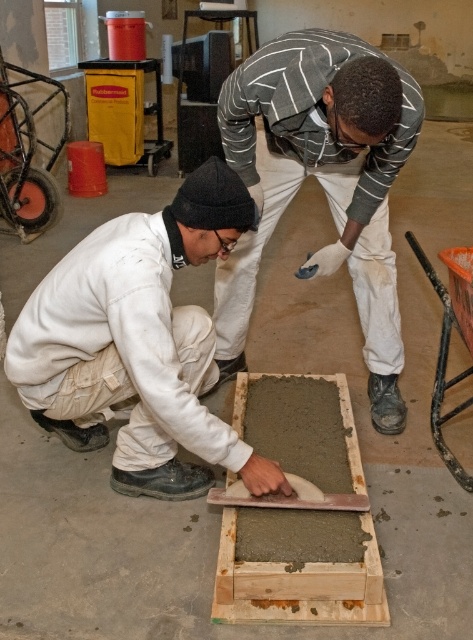
You are a safety inspector in this workshop. You notice two workers wearing the white matte uniform at lower left and the striped sweater at center. According to safety protocols, workers must maintain a distance of at least 1 meter from each other when handling hazardous materials. Can you determine if they are complying with this rule?

The striped sweater at center is behind the white matte uniform at lower left, but the exact distance between them is not specified in the description. Therefore, it is unclear if they are maintaining the required 1 meter distance.

You are standing in the workshop and want to pick up an object that is closer to you. Which point should you go to, point (55, 349) or point (339, 376)?

You should go to point (55, 349) because it is closer to the camera than point (339, 376).

Based on the photo, you are a safety inspector checking the workspace. You notice the white matte uniform at lower left and the smooth concrete plank at center. Which object is bigger in size?

The white matte uniform at lower left is larger in size than the smooth concrete plank at center according to the description.